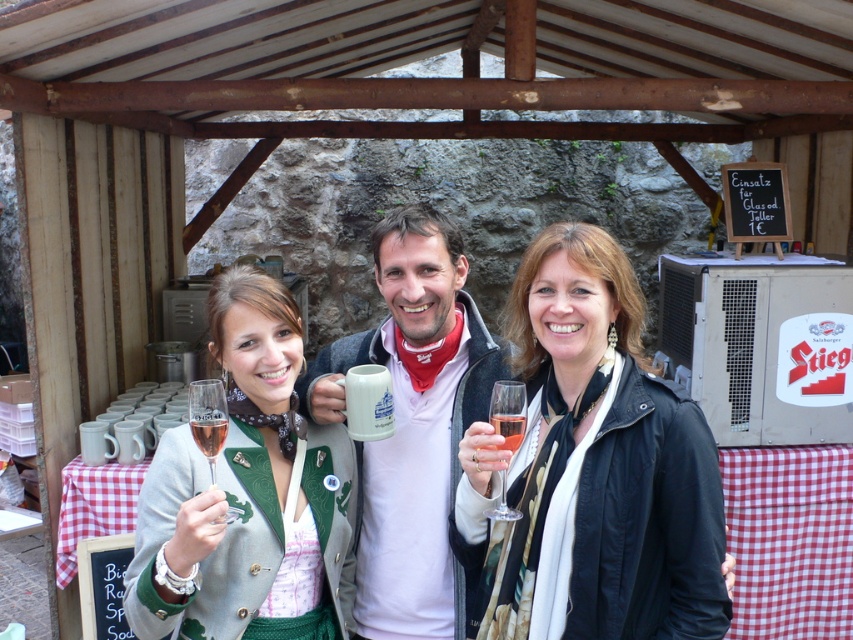
You are at a festive outdoor event and need to place a 24 inch long decorative banner between the white matte mug at center and the clear glass champagne flute at lower left. Can the banner fit between them?

The distance between the white matte mug at center and the clear glass champagne flute at lower left is 23.19 inches. Since the banner is 24 inches long, it cannot fit between them as the banner is longer than the available space.